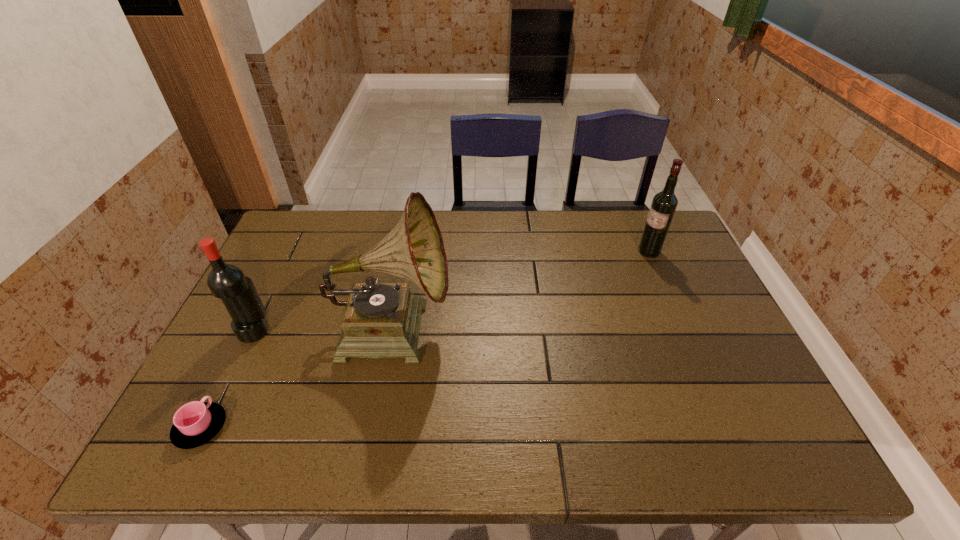
The height and width of the screenshot is (540, 960). Identify the location of the third object from left to right. (380, 320).

Identify the location of record player. The image size is (960, 540). (380, 320).

I want to click on the right wine bottle, so click(664, 203).

Identify the location of the rightmost object. (664, 203).

Where is `the nearer wine bottle`? The image size is (960, 540). the nearer wine bottle is located at coordinates tap(225, 281).

The height and width of the screenshot is (540, 960). I want to click on cup, so click(195, 423).

This screenshot has height=540, width=960. I want to click on the shortest object, so click(195, 423).

At what (x,y) coordinates should I click in order to perform the action: click on vacant space located 0.180m from the horn of the second object from right to left. Please return your answer as a coordinate pair (x, y). This screenshot has width=960, height=540. Looking at the image, I should click on (518, 327).

At what (x,y) coordinates should I click in order to perform the action: click on free space located 0.200m on the front and back of the rightmost object. Please return your answer as a coordinate pair (x, y). The width and height of the screenshot is (960, 540). Looking at the image, I should click on (576, 252).

Where is `vacant space situated 0.400m on the front and back of the rightmost object`? Image resolution: width=960 pixels, height=540 pixels. vacant space situated 0.400m on the front and back of the rightmost object is located at coordinates (514, 252).